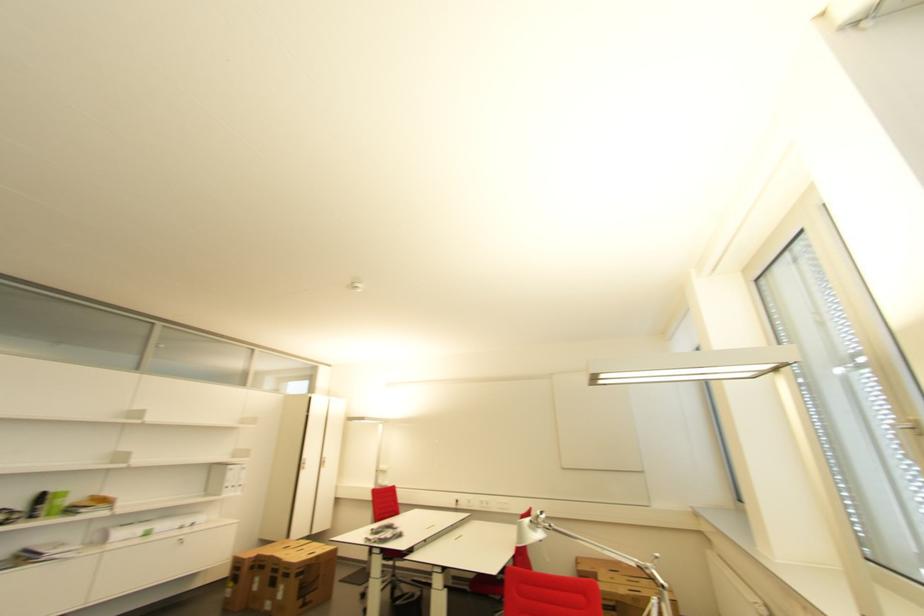
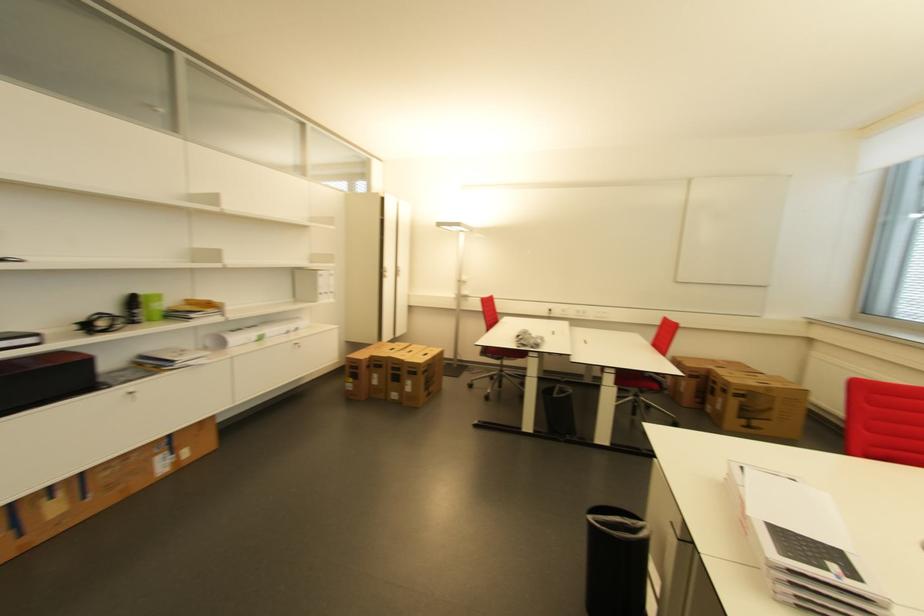
The point at (x=55, y=498) is marked in the first image. Where is the corresponding point in the second image?

(147, 301)